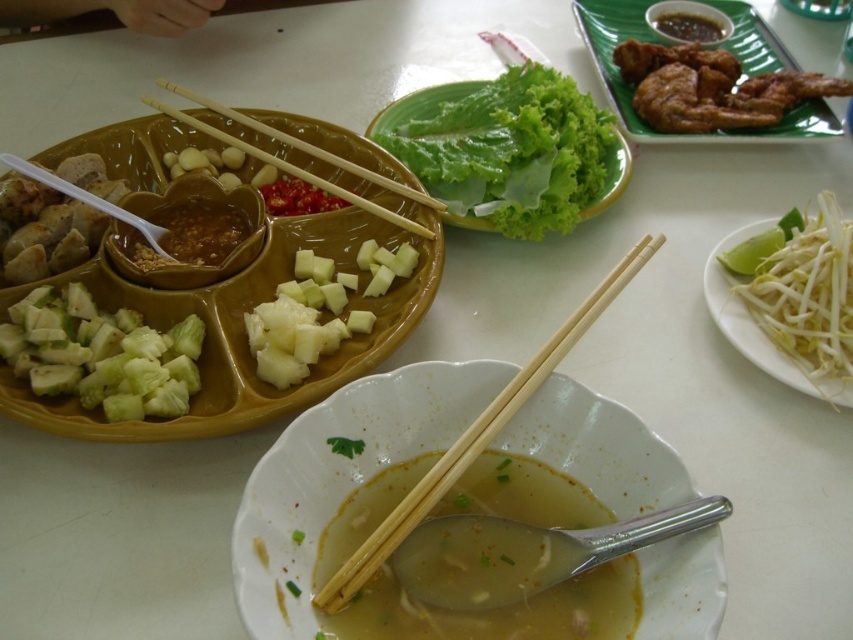
In the scene shown: Is white ceramic bowl at center further to camera compared to yellowish matte pineapple at center?

No, it is not.

This screenshot has height=640, width=853. I want to click on white ceramic bowl at center, so click(339, 477).

The height and width of the screenshot is (640, 853). I want to click on white ceramic bowl at center, so click(339, 477).

In order to click on white ceramic bowl at center in this screenshot , I will do `click(339, 477)`.

Measure the distance between point (404,177) and camera.

The distance of point (404,177) from camera is 36.72 inches.

Find the location of `green matte platter at upper left`. green matte platter at upper left is located at coordinates (242, 324).

Where is `green matte platter at upper left`? green matte platter at upper left is located at coordinates (242, 324).

Which is below, green matte platter at upper left or brown glossy sauce at upper center?

green matte platter at upper left is below.

Which is in front, point (358, 342) or point (704, 13)?

Point (358, 342) is more forward.

The image size is (853, 640). Describe the element at coordinates (242, 324) in the screenshot. I see `green matte platter at upper left` at that location.

Locate an element on the screen. green matte platter at upper left is located at coordinates (242, 324).